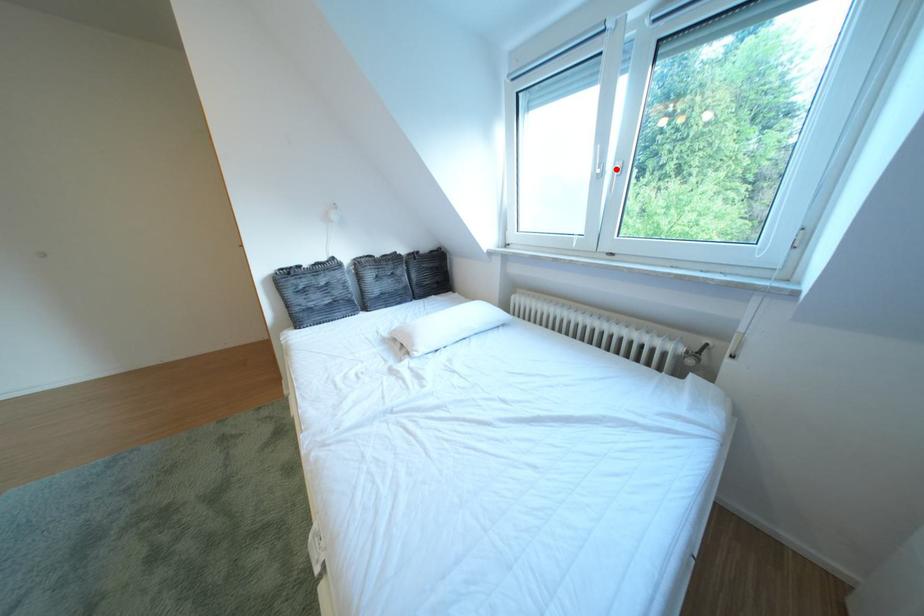
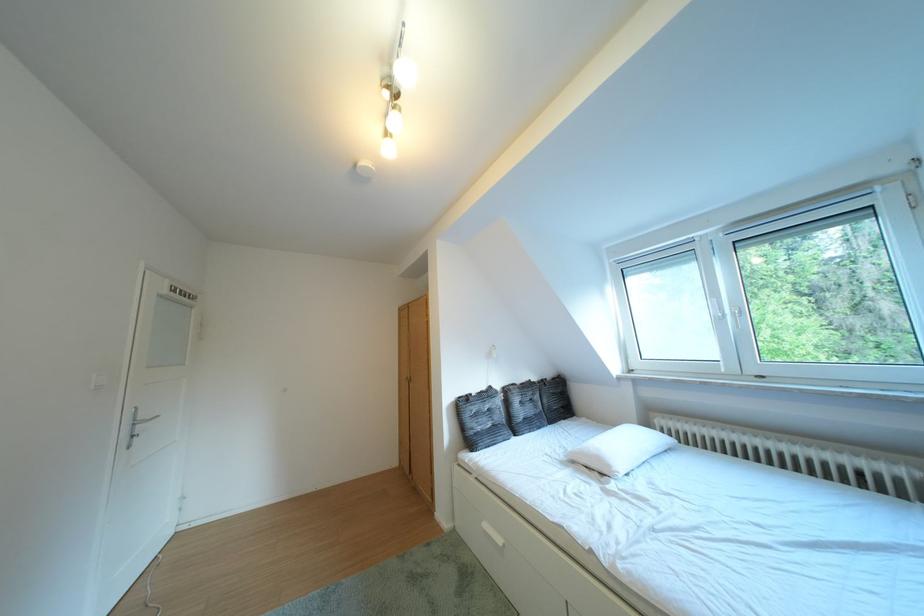
Find the pixel in the second image that matches the highlighted location in the first image.

(736, 315)